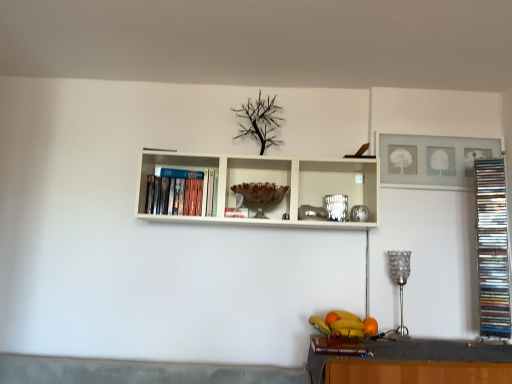
Question: Considering the relative sizes of matte plastic dvds at left, the third book when ordered from front to back, and orange matte at lower right in the image provided, is matte plastic dvds at left, the third book when ordered from front to back, smaller than orange matte at lower right?

Choices:
 (A) no
 (B) yes

Answer: (A)

Question: Can you confirm if matte plastic dvds at left, the third book when ordered from front to back, is bigger than orange matte at lower right?

Choices:
 (A) no
 (B) yes

Answer: (B)

Question: Does matte plastic dvds at left, the 1th book positioned from the back, contain orange matte at lower right?

Choices:
 (A) no
 (B) yes

Answer: (A)

Question: Does matte plastic dvds at left, the 1th book positioned from the back, appear on the right side of orange matte at lower right?

Choices:
 (A) no
 (B) yes

Answer: (A)

Question: Is the surface of matte plastic dvds at left, placed as the 3th book when sorted from right to left, in direct contact with orange matte at lower right?

Choices:
 (A) yes
 (B) no

Answer: (B)

Question: Relative to shiny metallic fruit basket at lower center, is metallic silver stack of cds at right, which is the 1th book from right to left, in front or behind?

Choices:
 (A) behind
 (B) front

Answer: (A)

Question: From a real-world perspective, is metallic silver stack of cds at right, arranged as the second book when viewed from the front, physically located above or below shiny metallic fruit basket at lower center?

Choices:
 (A) below
 (B) above

Answer: (B)

Question: Is metallic silver stack of cds at right, placed as the third book when sorted from left to right, situated inside shiny metallic fruit basket at lower center or outside?

Choices:
 (A) inside
 (B) outside

Answer: (B)

Question: Is point (488, 266) positioned closer to the camera than point (327, 326)?

Choices:
 (A) farther
 (B) closer

Answer: (A)

Question: Considering the positions of point click(163, 178) and point click(359, 322), is point click(163, 178) closer or farther from the camera than point click(359, 322)?

Choices:
 (A) farther
 (B) closer

Answer: (A)

Question: From their relative heights in the image, would you say matte plastic dvds at left, the third book when ordered from front to back, is taller or shorter than shiny metallic fruit basket at lower center?

Choices:
 (A) short
 (B) tall

Answer: (B)

Question: Considering the positions of matte plastic dvds at left, placed as the 3th book when sorted from right to left, and shiny metallic fruit basket at lower center in the image, is matte plastic dvds at left, placed as the 3th book when sorted from right to left, wider or thinner than shiny metallic fruit basket at lower center?

Choices:
 (A) thin
 (B) wide

Answer: (A)

Question: From the image's perspective, is matte plastic dvds at left, the 1th book positioned from the back, above or below shiny metallic fruit basket at lower center?

Choices:
 (A) above
 (B) below

Answer: (A)

Question: Which is correct: brown glass bowl at center is inside orange matte at lower right, or outside of it?

Choices:
 (A) inside
 (B) outside

Answer: (B)

Question: In the image, is brown glass bowl at center positioned in front of or behind orange matte at lower right?

Choices:
 (A) behind
 (B) front

Answer: (A)